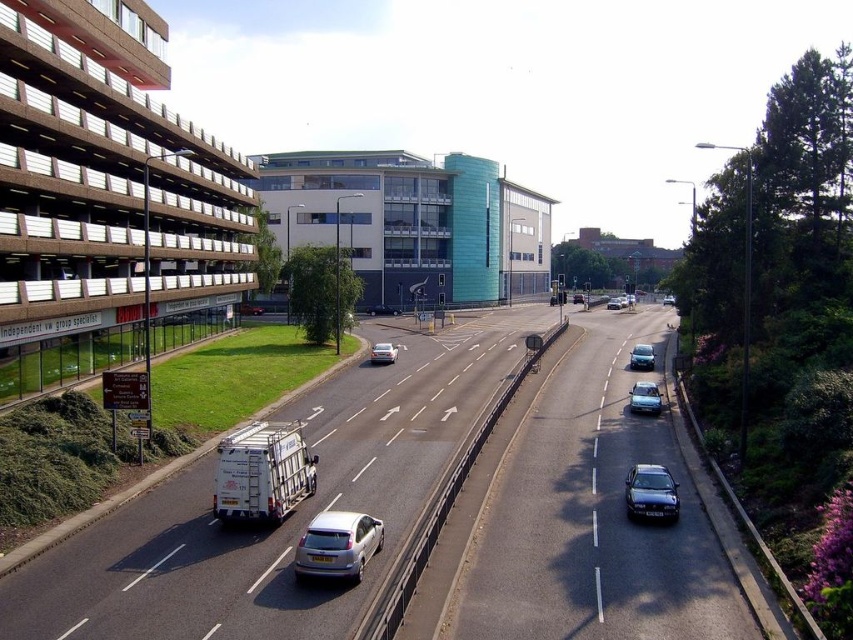
Question: Observing the image, what is the correct spatial positioning of silver metallic hatchback at center in reference to silver metallic sedan at center?

Choices:
 (A) below
 (B) above

Answer: (A)

Question: Can you confirm if satin silver sedan at center is positioned to the right of metallic silver sedan at center?

Choices:
 (A) no
 (B) yes

Answer: (A)

Question: Which is farther from the satin silver sedan at center?

Choices:
 (A) shiny black sedan at center
 (B) metallic silver sedan at center-right
 (C) smooth asphalt highway at center

Answer: (A)

Question: Which of these objects is positioned farthest from the metallic silver sedan at center?

Choices:
 (A) satin silver sedan at center
 (B) satin silver sedan at center-right

Answer: (A)

Question: Is metallic silver sedan at center-right in front of metallic silver sedan at center?

Choices:
 (A) no
 (B) yes

Answer: (B)

Question: Which of the following is the farthest from the observer?

Choices:
 (A) satin silver sedan at center
 (B) metallic silver sedan at center
 (C) shiny black sedan at center

Answer: (B)